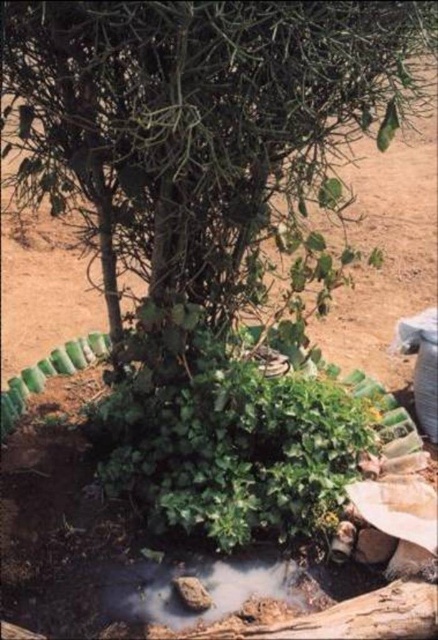
You are a gardener who wants to plant a new flower. The green matte tree at center is in the way. Can you move the brown dirt puddle at lower center to make space for the flower?

The green matte tree at center is larger than the brown dirt puddle at lower center, so you can move the brown dirt puddle at lower center to make space for the flower since it is smaller.

You are a gardener who needs to water the green matte tree at center. You see the brown dirt puddle at lower center. Where should you direct the water flow to ensure it reaches the tree roots?

The green matte tree at center is positioned over the brown dirt puddle at lower center, so directing water towards the puddle will ensure it reaches the tree roots.